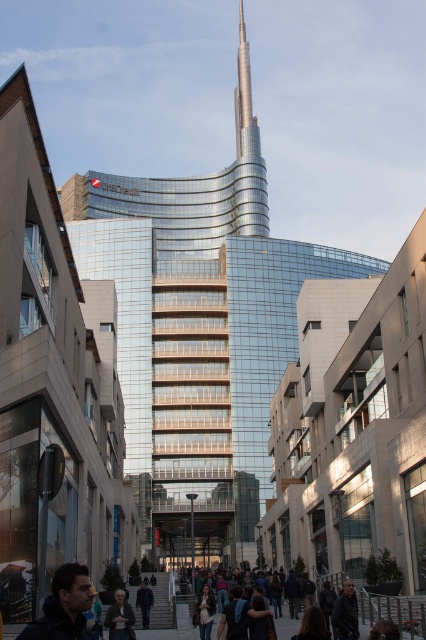
Question: Does glassy metallic tower at center appear over dark blue jacket at lower left?

Choices:
 (A) no
 (B) yes

Answer: (B)

Question: Can you confirm if glassy metallic tower at center is positioned above dark brown leather jacket at lower center?

Choices:
 (A) yes
 (B) no

Answer: (A)

Question: Does dark brown leather jacket at lower center have a greater width compared to dark gray jacket at center?

Choices:
 (A) no
 (B) yes

Answer: (A)

Question: Among these objects, which one is nearest to the camera?

Choices:
 (A) glassy metallic tower at center
 (B) gold metallic spire at center

Answer: (A)

Question: Among these objects, which one is nearest to the camera?

Choices:
 (A) glassy metallic tower at center
 (B) dark blue jacket at lower left

Answer: (B)

Question: Among these objects, which one is farthest from the camera?

Choices:
 (A) dark gray jacket at center
 (B) dark blue jacket at lower left

Answer: (A)